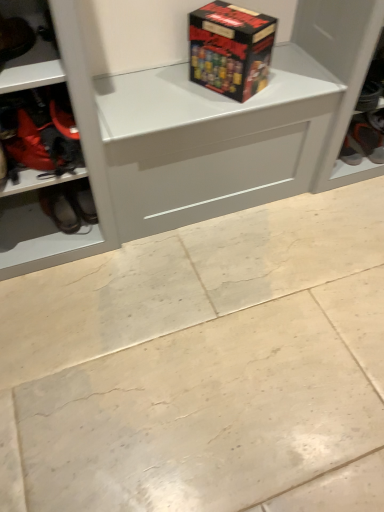
At what (x,y) coordinates should I click in order to perform the action: click on vacant space that is to the left of black leather shoes at lower left, placed as the 2th footwear when sorted from left to right. Please return your answer as a coordinate pair (x, y). The width and height of the screenshot is (384, 512). Looking at the image, I should click on (28, 233).